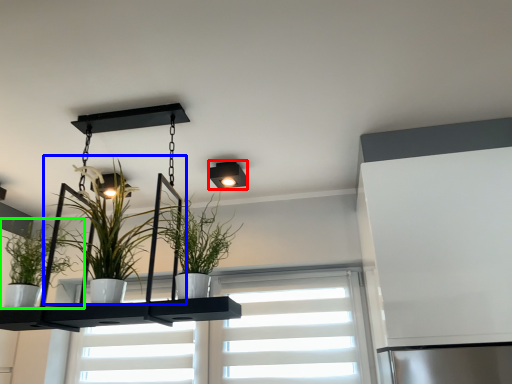
Question: Estimate the real-world distances between objects in this image. Which object is closer to light fixture (highlighted by a red box), houseplant (highlighted by a blue box) or houseplant (highlighted by a green box)?

Choices:
 (A) houseplant
 (B) houseplant

Answer: (A)